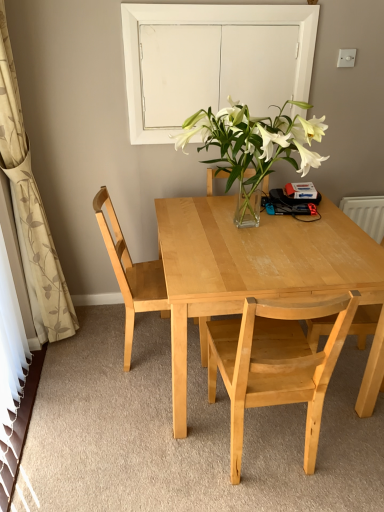
Question: Is point (31, 263) positioned closer to the camera than point (96, 204)?

Choices:
 (A) closer
 (B) farther

Answer: (B)

Question: Considering the positions of beige floral fabric curtain at left and light wood chair at left, which ranks as the 1th chair in left-to-right order, in the image, is beige floral fabric curtain at left bigger or smaller than light wood chair at left, which ranks as the 1th chair in left-to-right order,?

Choices:
 (A) big
 (B) small

Answer: (A)

Question: Which is farther from the light wood chair at center, which is the second chair in right-to-left order?

Choices:
 (A) white glass door at upper center
 (B) beige floral fabric curtain at left
 (C) light wood chair at left, which ranks as the 1th chair in left-to-right order
 (D) light wood chair at right, acting as the first chair starting from the right
 (E) light wood table at center

Answer: (A)

Question: Estimate the real-world distances between objects in this image. Which object is closer to the light wood chair at right, acting as the third chair starting from the left?

Choices:
 (A) beige floral fabric curtain at left
 (B) light wood table at center
 (C) light wood chair at left, the third chair from the right
 (D) light wood chair at center, arranged as the second chair when viewed from the left
 (E) white glass door at upper center

Answer: (D)